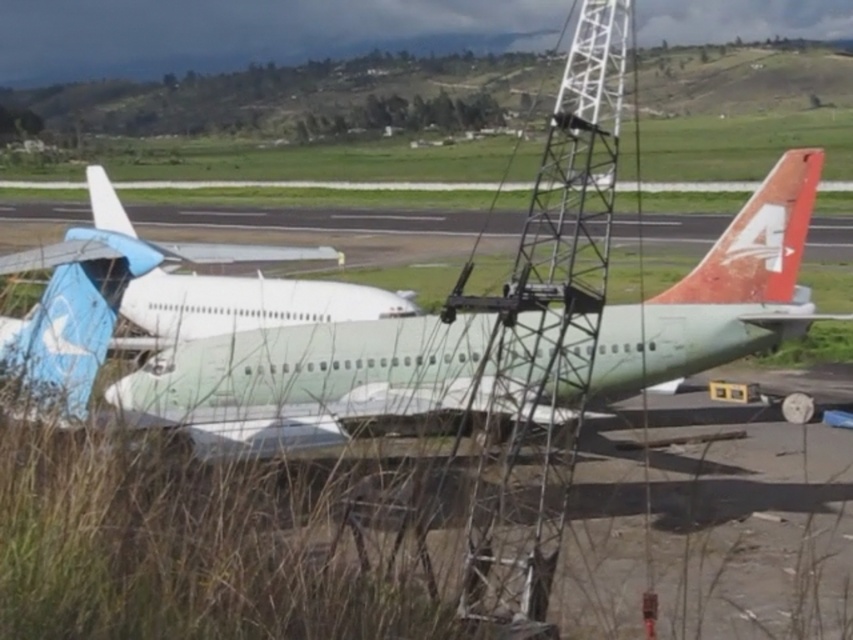
Who is more distant from viewer, [264,432] or [808,177]?

Positioned behind is point [808,177].

Does white matte airplane at center appear on the left side of rusty orange tail fin at right?

Correct, you'll find white matte airplane at center to the left of rusty orange tail fin at right.

The image size is (853, 640). Describe the element at coordinates (271, 372) in the screenshot. I see `white matte airplane at center` at that location.

At what (x,y) coordinates should I click in order to perform the action: click on white matte airplane at center. Please return your answer as a coordinate pair (x, y). The height and width of the screenshot is (640, 853). Looking at the image, I should click on (271, 372).